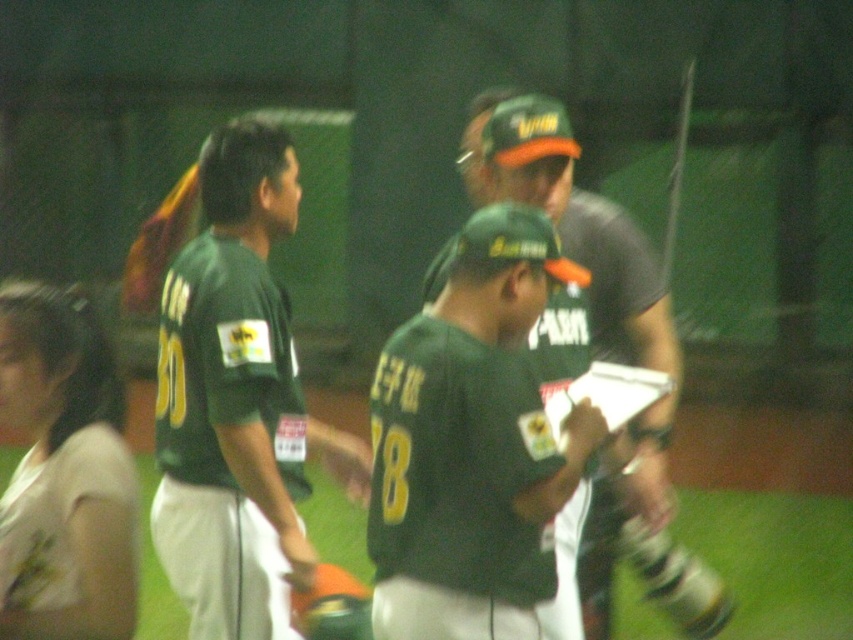
Question: Based on their relative distances, which object is nearer to the matte green jersey at center?

Choices:
 (A) matte green cap at center
 (B) green matte jersey at center

Answer: (A)

Question: Estimate the real-world distances between objects in this image. Which object is farther from the matte green cap at center?

Choices:
 (A) green matte jersey at center
 (B) matte green jersey at center

Answer: (A)

Question: From the image, what is the correct spatial relationship of green matte jersey at center in relation to matte green cap at center?

Choices:
 (A) right
 (B) left

Answer: (B)

Question: Is matte green jersey at center bigger than green matte jersey at center?

Choices:
 (A) no
 (B) yes

Answer: (B)

Question: Which point is closer to the camera taking this photo?

Choices:
 (A) (579, 220)
 (B) (498, 381)
 (C) (175, 589)

Answer: (B)

Question: Is matte green jersey at center positioned in front of green matte jersey at center?

Choices:
 (A) yes
 (B) no

Answer: (A)